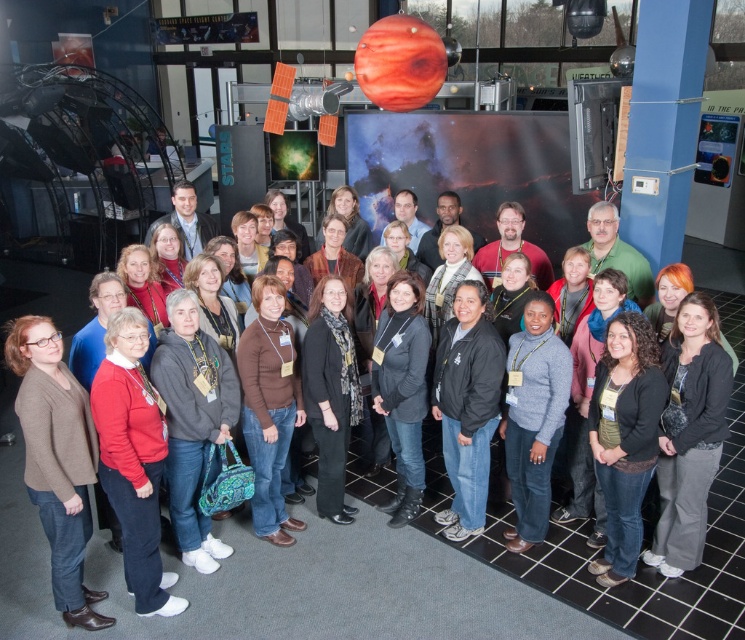
Question: Which of the following is the farthest from the observer?

Choices:
 (A) brown sweater at lower left
 (B) brown wool sweater at center

Answer: (B)

Question: Can you confirm if gray fleece sweater at center is bigger than brown matte sweater at center?

Choices:
 (A) no
 (B) yes

Answer: (B)

Question: Estimate the real-world distances between objects in this image. Which object is farther from the black matte jacket at center?

Choices:
 (A) gray fleece sweater at center
 (B) gray sweater at center
 (C) black leather jacket at center

Answer: (A)

Question: Does brown sweater at lower left appear on the left side of brown matte sweater at center?

Choices:
 (A) yes
 (B) no

Answer: (A)

Question: Which object appears farthest from the camera in this image?

Choices:
 (A) brown matte sweater at center
 (B) black matte jacket at center
 (C) black leather jacket at center

Answer: (C)

Question: Does brown wool sweater at center appear on the right side of black leather jacket at center?

Choices:
 (A) yes
 (B) no

Answer: (B)